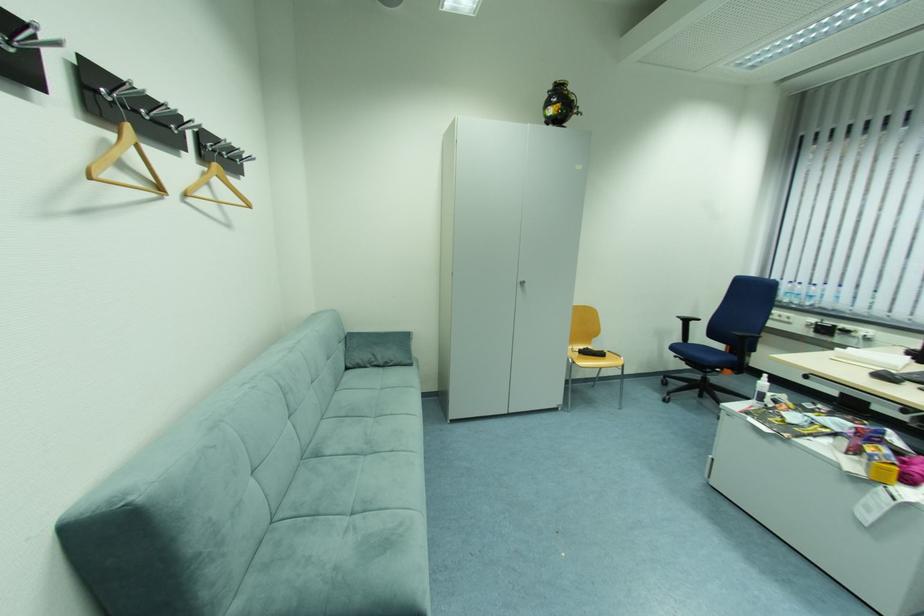
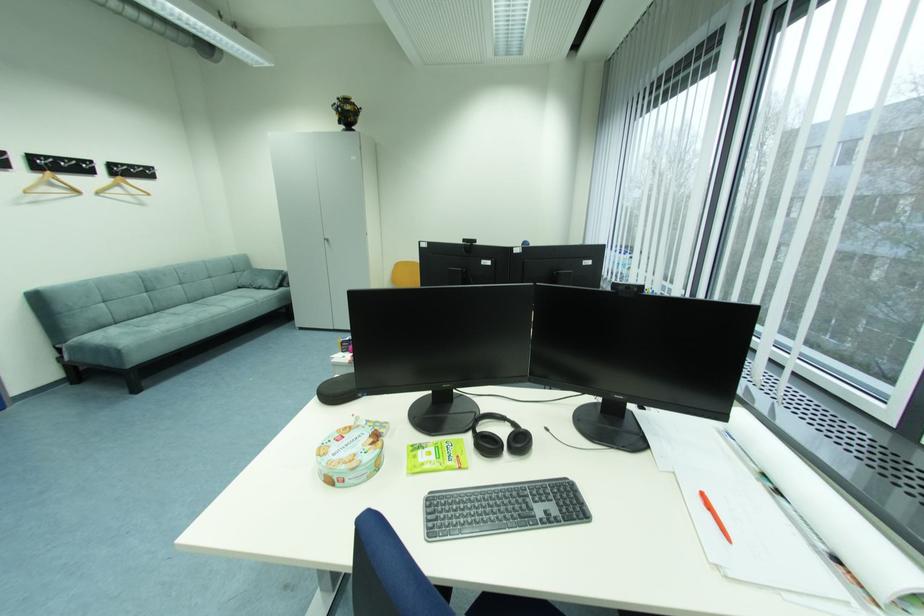
Where in the second image is the point corresponding to (393,363) from the first image?

(266, 286)